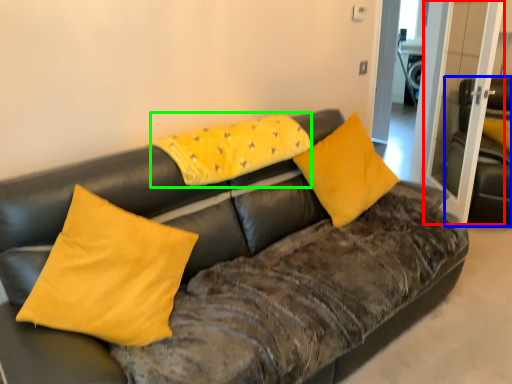
Question: Based on their relative distances, which object is farther from glass door (highlighted by a red box)? Choose from armchair (highlighted by a blue box) and pillow (highlighted by a green box).

Choices:
 (A) armchair
 (B) pillow

Answer: (B)